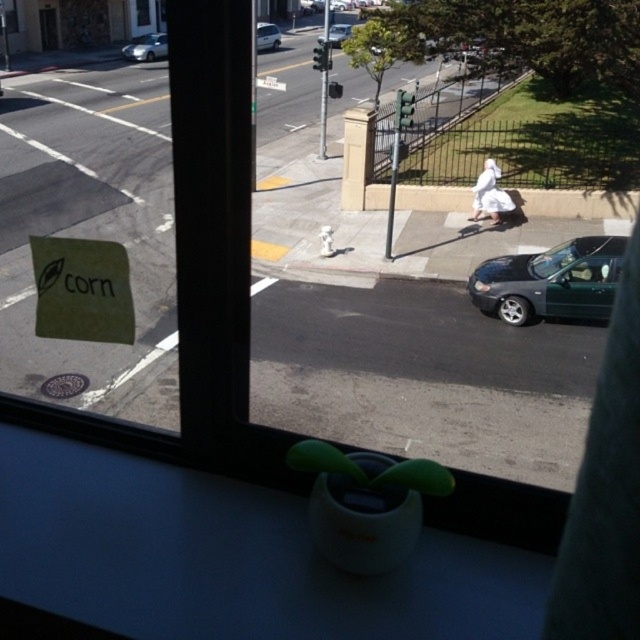
Question: Which of the following is the closest to the observer?

Choices:
 (A) metallic silver sedan at center
 (B) silver metallic car at upper center

Answer: (A)

Question: Does green matte car at lower right have a lesser width compared to metallic silver sedan at center?

Choices:
 (A) yes
 (B) no

Answer: (A)

Question: Considering the real-world distances, which object is farthest from the matte paper sign at lower left?

Choices:
 (A) green matte car at lower right
 (B) silver metallic car at upper center
 (C) silver metallic sedan at upper left

Answer: (C)

Question: Can you confirm if silver metallic sedan at upper left is bigger than metallic silver sedan at center?

Choices:
 (A) yes
 (B) no

Answer: (B)

Question: Which point appears farthest from the camera in this image?

Choices:
 (A) (268, 49)
 (B) (65, 291)
 (C) (611, 262)
 (D) (337, 36)

Answer: (A)

Question: Can you confirm if matte paper sign at lower left is smaller than metallic silver sedan at center?

Choices:
 (A) no
 (B) yes

Answer: (B)